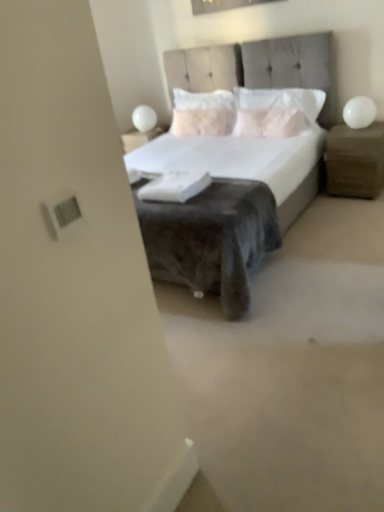
Question: Is white textured pillow at center, marked as the 1th pillow in a left-to-right arrangement, in contact with white soft pillow at center, acting as the second pillow starting from the left?

Choices:
 (A) no
 (B) yes

Answer: (A)

Question: Is white textured pillow at center, which is the 2th pillow from right to left, closer to camera compared to white soft pillow at center, acting as the second pillow starting from the left?

Choices:
 (A) no
 (B) yes

Answer: (A)

Question: From the image's perspective, is white textured pillow at center, which is the 2th pillow from right to left, under white soft pillow at center, the first pillow in the right-to-left sequence?

Choices:
 (A) yes
 (B) no

Answer: (B)

Question: Would you say white textured pillow at center, marked as the 1th pillow in a left-to-right arrangement, is outside white soft pillow at center, the first pillow in the right-to-left sequence?

Choices:
 (A) no
 (B) yes

Answer: (B)

Question: Is white textured pillow at center, which is the 2th pillow from right to left, wider than white soft pillow at center, the first pillow in the right-to-left sequence?

Choices:
 (A) no
 (B) yes

Answer: (A)

Question: Is white textured pillow at center, which is the 2th pillow from right to left, facing towards white soft pillow at center, acting as the second pillow starting from the left?

Choices:
 (A) yes
 (B) no

Answer: (B)

Question: Would you say white soft pillow at center, acting as the second pillow starting from the left, is a long distance from white glossy sphere at upper left, which is the second table lamp from bottom to top?

Choices:
 (A) yes
 (B) no

Answer: (A)

Question: Is white soft pillow at center, the first pillow in the right-to-left sequence, facing away from white glossy sphere at upper left, marked as the 2th table lamp in a front-to-back arrangement?

Choices:
 (A) yes
 (B) no

Answer: (B)

Question: Considering the relative positions of white soft pillow at center, acting as the second pillow starting from the left, and white glossy sphere at upper left, which is counted as the first table lamp, starting from the left, in the image provided, is white soft pillow at center, acting as the second pillow starting from the left, behind white glossy sphere at upper left, which is counted as the first table lamp, starting from the left,?

Choices:
 (A) no
 (B) yes

Answer: (A)

Question: Does white soft pillow at center, acting as the second pillow starting from the left, lie in front of white glossy sphere at upper left, positioned as the first table lamp in top-to-bottom order?

Choices:
 (A) no
 (B) yes

Answer: (B)

Question: From a real-world perspective, is white soft pillow at center, acting as the second pillow starting from the left, located beneath white glossy sphere at upper left, positioned as the first table lamp in top-to-bottom order?

Choices:
 (A) no
 (B) yes

Answer: (A)

Question: Are white soft pillow at center, acting as the second pillow starting from the left, and white glossy sphere at upper left, positioned as the 1th table lamp in back-to-front order, making contact?

Choices:
 (A) yes
 (B) no

Answer: (B)

Question: Does white glossy table lamp at upper right, which is the 1th table lamp in right-to-left order, come in front of velvet gray bed at center?

Choices:
 (A) yes
 (B) no

Answer: (B)